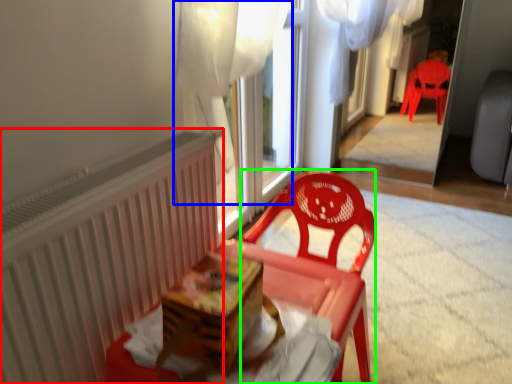
Question: Considering the real-world distances, which object is closest to radiator (highlighted by a red box)? curtain (highlighted by a blue box) or chair (highlighted by a green box).

Choices:
 (A) curtain
 (B) chair

Answer: (B)